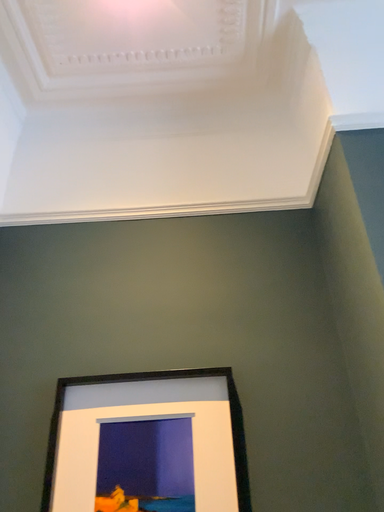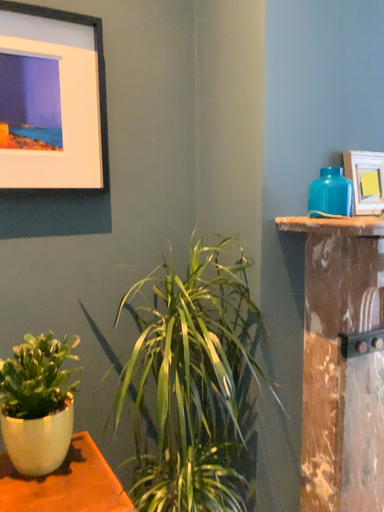
Question: Which way did the camera rotate in the video?

Choices:
 (A) rotated right
 (B) rotated left

Answer: (A)